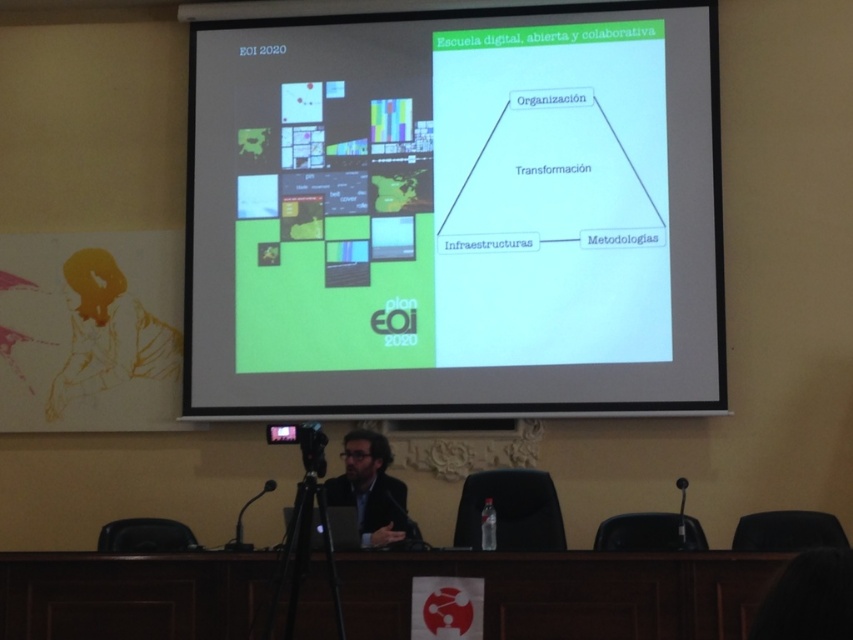
Is white matte projector screen at upper center in front of dark suit at center?

No.

Does point (279, 275) come farther from viewer compared to point (402, 486)?

Yes.

You are a GUI agent. You are given a task and a screenshot of the screen. Output one action in this format:
    pyautogui.click(x=<x>, y=<y>)
    Task: Click on the white matte projector screen at upper center
    The width and height of the screenshot is (853, 640).
    Given the screenshot: What is the action you would take?
    pyautogui.click(x=456, y=212)

Is yellow sketch at left shorter than dark suit at center?

In fact, yellow sketch at left may be taller than dark suit at center.

The height and width of the screenshot is (640, 853). I want to click on yellow sketch at left, so click(108, 337).

Does brown wooden table at lower center appear on the left side of black plastic microphone at lower left?

No, brown wooden table at lower center is not to the left of black plastic microphone at lower left.

Identify the location of brown wooden table at lower center. (567, 593).